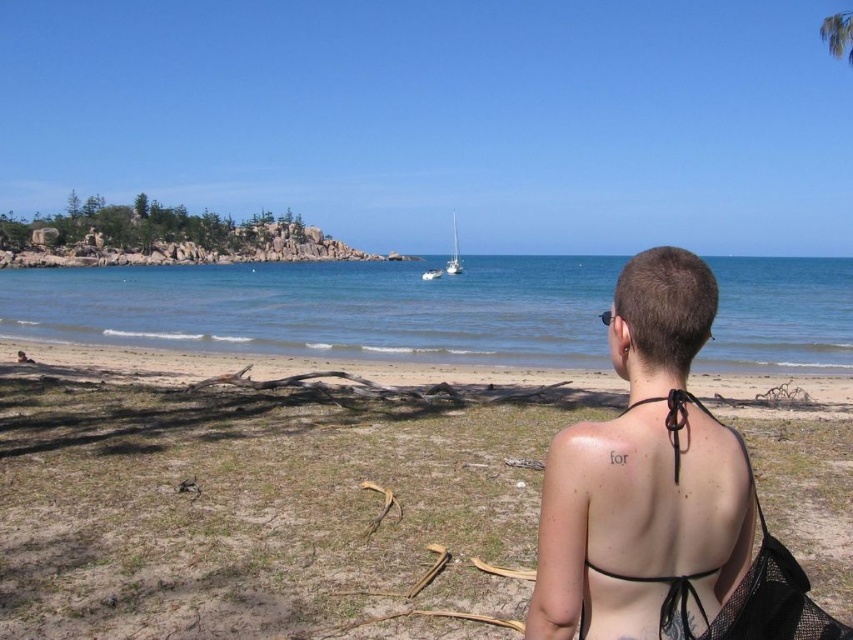
Question: Considering the real-world distances, which object is farthest from the brown sand at lower center?

Choices:
 (A) white glossy sailboat at center
 (B) clear blue water at center
 (C) skinny black bikini top at center
 (D) green leafy palm tree at upper right

Answer: (A)

Question: Does brown sand at lower center come behind skinny black bikini top at center?

Choices:
 (A) no
 (B) yes

Answer: (B)

Question: Which of the following is the farthest from the observer?

Choices:
 (A) green leafy palm tree at upper right
 (B) white glossy sailboat at center

Answer: (B)

Question: Can you confirm if green leafy palm tree at upper right is positioned below white glossy sailboat at center?

Choices:
 (A) no
 (B) yes

Answer: (A)

Question: In this image, where is brown sand at lower center located relative to white glossy sailboat at center?

Choices:
 (A) above
 (B) below

Answer: (B)

Question: Estimate the real-world distances between objects in this image. Which object is closer to the white glossy sailboat at center?

Choices:
 (A) skinny black bikini top at center
 (B) brown sand at lower center
 (C) clear blue water at center
 (D) green leafy palm tree at upper right

Answer: (C)